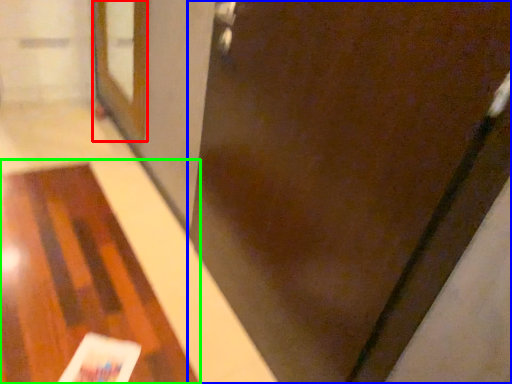
Question: Based on their relative distances, which object is nearer to screen door (highlighted by a red box)? Choose from door (highlighted by a blue box) and table (highlighted by a green box).

Choices:
 (A) door
 (B) table

Answer: (B)